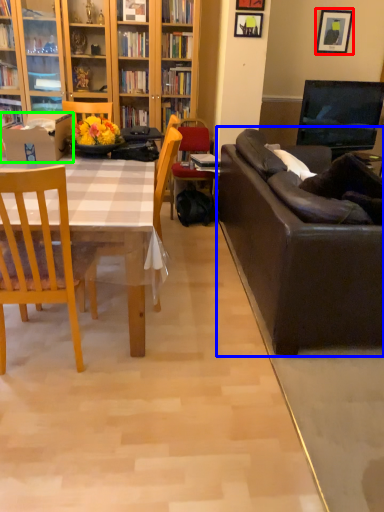
Question: Considering the real-world distances, which object is farthest from picture frame (highlighted by a red box)? studio couch (highlighted by a blue box) or box (highlighted by a green box)?

Choices:
 (A) studio couch
 (B) box

Answer: (B)